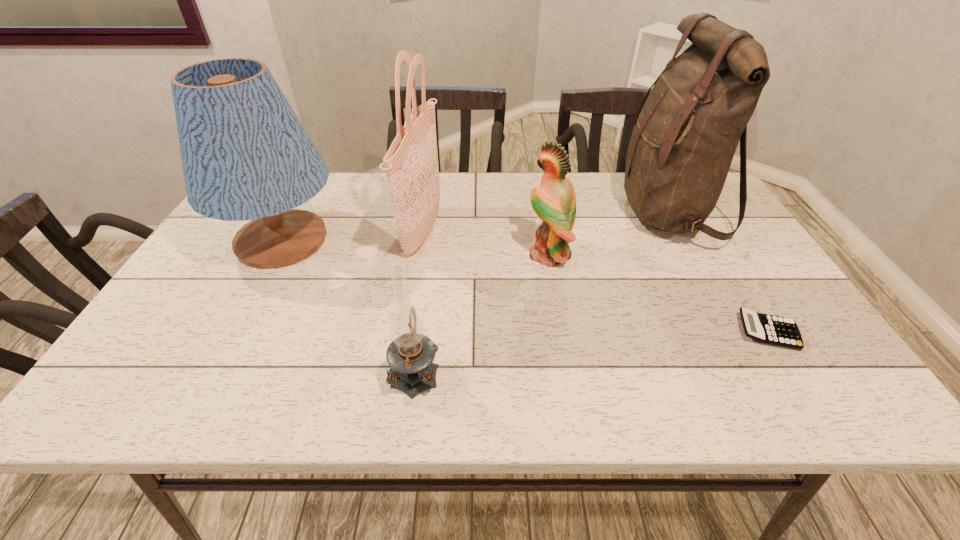
Where is `vacant area situated 0.180m on the front of the leftmost object`? This screenshot has height=540, width=960. vacant area situated 0.180m on the front of the leftmost object is located at coordinates pos(231,338).

Locate an element on the screen. The height and width of the screenshot is (540, 960). vacant space located 0.250m on the front-facing side of the third object from right to left is located at coordinates (431, 254).

Where is `free spot located on the front-facing side of the third object from right to left`? This screenshot has height=540, width=960. free spot located on the front-facing side of the third object from right to left is located at coordinates (413, 254).

Where is `vacant space located 0.370m on the front-facing side of the third object from right to left`? vacant space located 0.370m on the front-facing side of the third object from right to left is located at coordinates (386, 254).

The height and width of the screenshot is (540, 960). In order to click on vacant space located 0.080m on the back of the oil lamp in this screenshot , I will do [x=422, y=316].

The width and height of the screenshot is (960, 540). Identify the location of vacant space situated on the back of the calculator. (722, 257).

Where is `backpack positioned at the far edge`? The height and width of the screenshot is (540, 960). backpack positioned at the far edge is located at coordinates (684, 139).

Identify the location of shopping bag located at the far edge. (411, 164).

Where is `lampshade that is at the far edge`? This screenshot has width=960, height=540. lampshade that is at the far edge is located at coordinates (246, 156).

The width and height of the screenshot is (960, 540). I want to click on object positioned at the near edge, so click(410, 355).